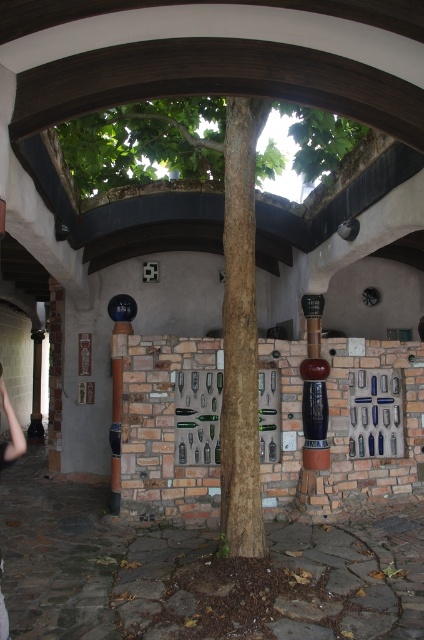
Between green leafy tree at center and skinny jeans at lower left, which one appears on the left side from the viewer's perspective?

Positioned to the left is skinny jeans at lower left.

Does green leafy tree at center have a lesser height compared to skinny jeans at lower left?

Incorrect, green leafy tree at center's height does not fall short of skinny jeans at lower left's.

Where is `green leafy tree at center`? The image size is (424, 640). green leafy tree at center is located at coordinates (223, 240).

Can you confirm if green leafy tree at center is positioned below shiny dark wood pillar at center?

Actually, green leafy tree at center is above shiny dark wood pillar at center.

Which is more to the left, green leafy tree at center or shiny dark wood pillar at center?

Positioned to the left is green leafy tree at center.

Is point (102, 138) farther from camera compared to point (314, 396)?

That is True.

The image size is (424, 640). I want to click on green leafy tree at center, so click(223, 240).

Does shiny dark wood pillar at center have a smaller size compared to skinny jeans at lower left?

Incorrect, shiny dark wood pillar at center is not smaller in size than skinny jeans at lower left.

Does point (307, 426) come behind point (5, 410)?

That is True.

Where is `shiny dark wood pillar at center`? shiny dark wood pillar at center is located at coordinates pos(314,388).